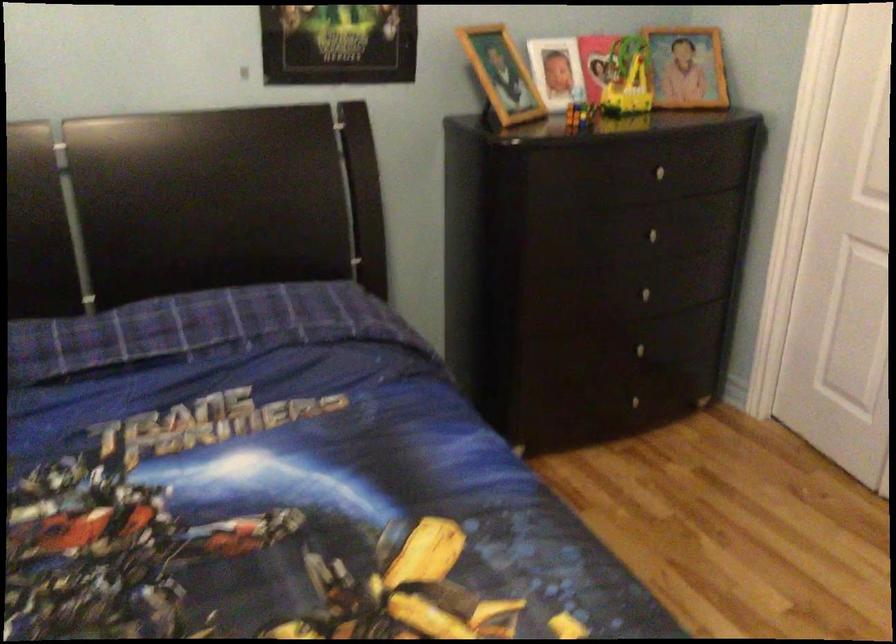
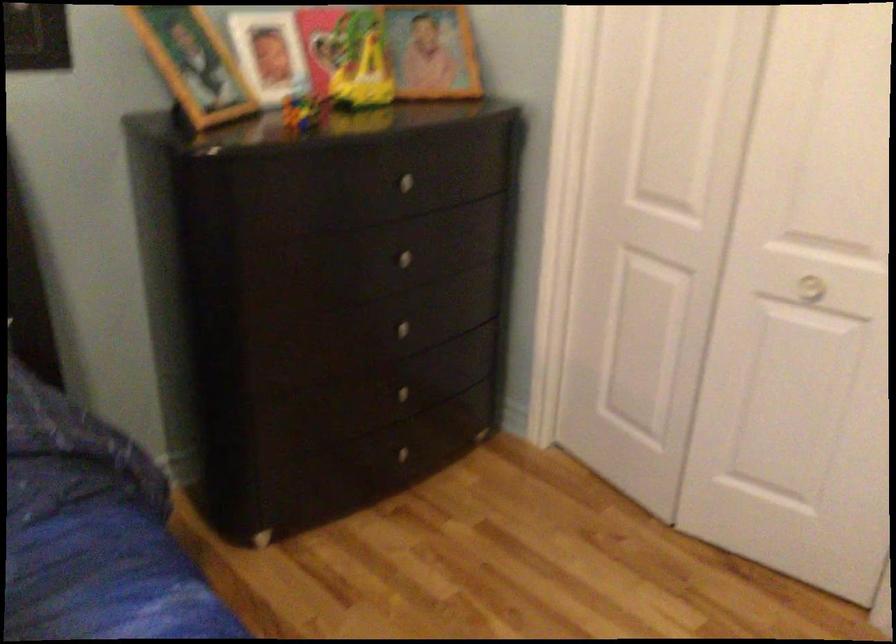
The point at (581, 111) is marked in the first image. Where is the corresponding point in the second image?

(303, 111)